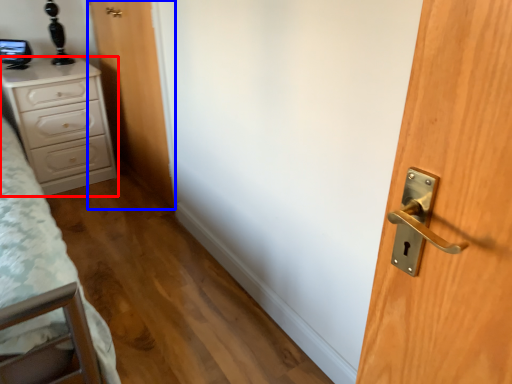
Question: Which object appears farthest to the camera in this image, chest of drawers (highlighted by a red box) or door (highlighted by a blue box)?

Choices:
 (A) chest of drawers
 (B) door

Answer: (A)